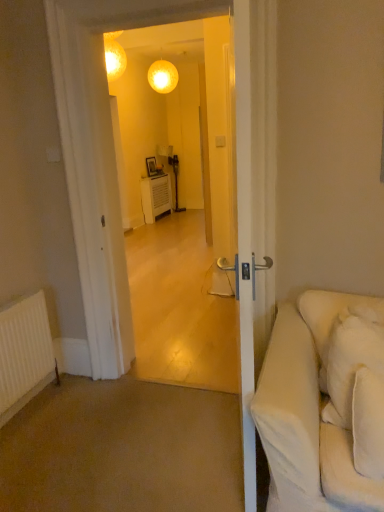
Question: Considering the positions of matte glass sphere at upper center and white soft pillow at right in the image, is matte glass sphere at upper center taller or shorter than white soft pillow at right?

Choices:
 (A) tall
 (B) short

Answer: (B)

Question: Considering their positions, is matte glass sphere at upper center located in front of or behind white soft pillow at right?

Choices:
 (A) front
 (B) behind

Answer: (B)

Question: Based on their relative distances, which object is nearer to the transparent glass door at center?

Choices:
 (A) white matte radiator at lower left
 (B) white soft pillow at right
 (C) matte glass sphere at upper center

Answer: (C)

Question: Based on their relative distances, which object is farther from the white matte radiator at lower left?

Choices:
 (A) matte glass sphere at upper center
 (B) transparent glass door at center
 (C) white soft pillow at right

Answer: (A)